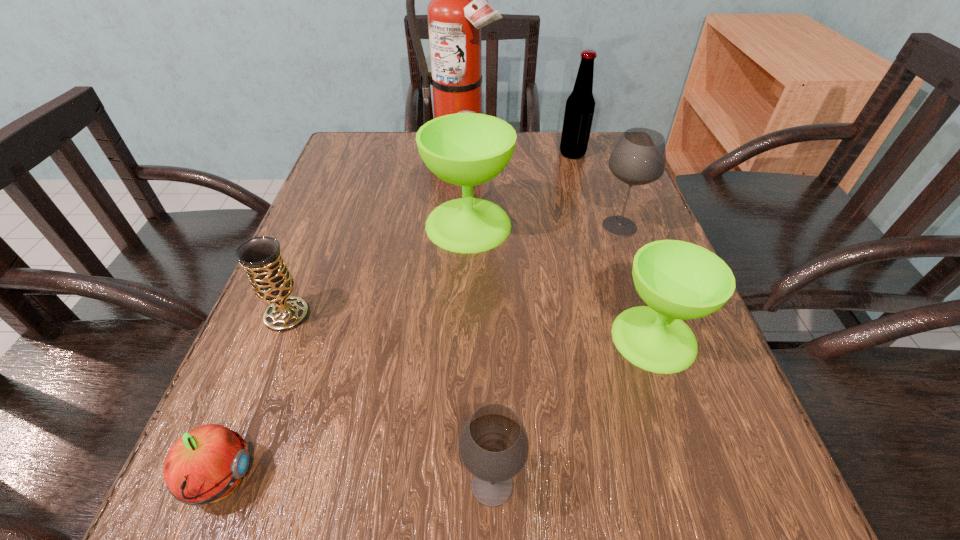
This screenshot has width=960, height=540. Identify the location of free space located 0.120m on the back of the shortest object. point(265,368).

Identify the location of fire extinguisher that is at the far edge. This screenshot has height=540, width=960. (458, 9).

Identify the location of beer bottle that is at the far edge. The width and height of the screenshot is (960, 540). (579, 110).

Locate an element on the screen. wineglass present at the near edge is located at coordinates [x=494, y=446].

At what (x,y) coordinates should I click in order to perform the action: click on apple present at the near edge. Please return your answer as a coordinate pair (x, y). This screenshot has width=960, height=540. Looking at the image, I should click on (206, 464).

Where is `chalice situated at the left edge`? The width and height of the screenshot is (960, 540). chalice situated at the left edge is located at coordinates 271,281.

Identify the location of apple that is at the left edge. The width and height of the screenshot is (960, 540). (206, 464).

The image size is (960, 540). I want to click on beer bottle located at the right edge, so click(x=579, y=110).

The width and height of the screenshot is (960, 540). Identify the location of object at the near left corner. (206, 464).

Where is `object present at the far right corner`? object present at the far right corner is located at coordinates (579, 110).